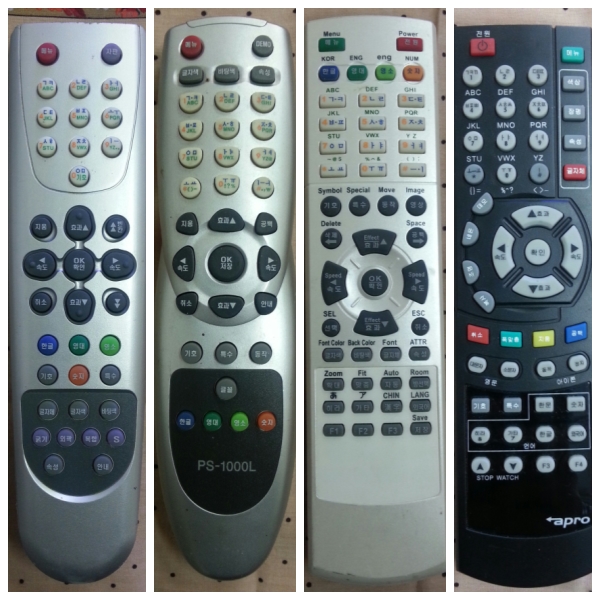
Identify the location of remote controls. (122, 194), (279, 199), (429, 189), (507, 204).